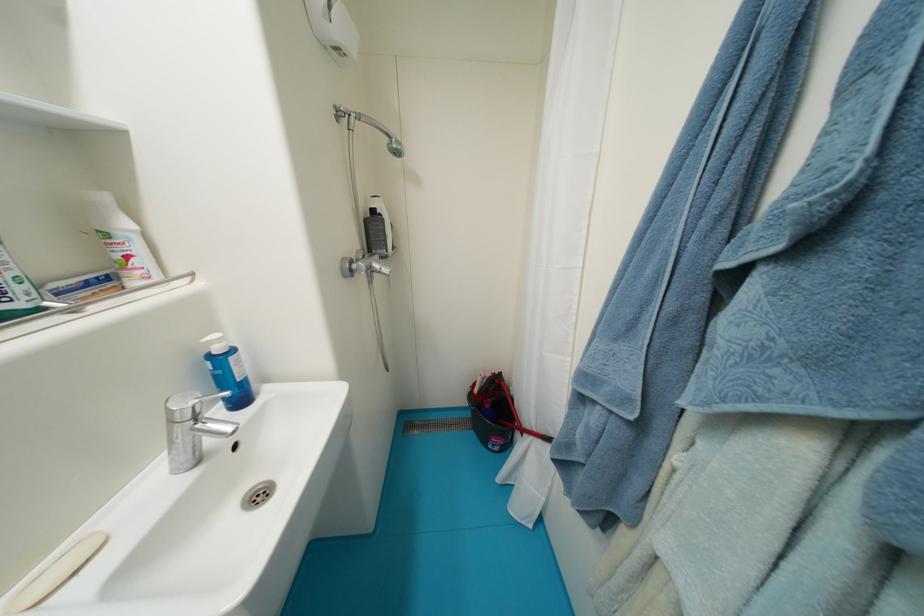
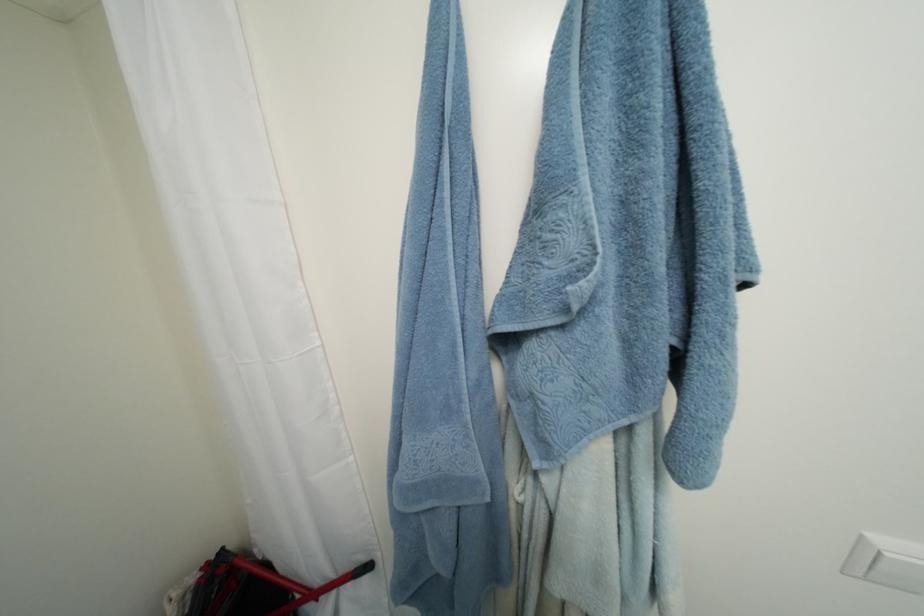
The point at (507, 375) is marked in the first image. Where is the corresponding point in the second image?

(229, 552)